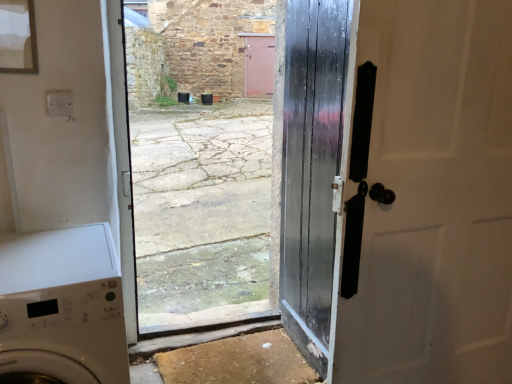
Question: Considering the relative sizes of matte black door at right, the first door when ordered from right to left, and glossy black door at center, placed as the 2th door when sorted from right to left, in the image provided, is matte black door at right, the first door when ordered from right to left, wider than glossy black door at center, placed as the 2th door when sorted from right to left,?

Choices:
 (A) yes
 (B) no

Answer: (A)

Question: From the image's perspective, is matte black door at right, positioned as the second door in left-to-right order, located beneath glossy black door at center, placed as the 2th door when sorted from right to left?

Choices:
 (A) yes
 (B) no

Answer: (A)

Question: Can you confirm if matte black door at right, the first door when ordered from right to left, is shorter than glossy black door at center, placed as the 2th door when sorted from right to left?

Choices:
 (A) no
 (B) yes

Answer: (B)

Question: Is matte black door at right, positioned as the second door in left-to-right order, positioned in front of glossy black door at center, placed as the 2th door when sorted from right to left?

Choices:
 (A) yes
 (B) no

Answer: (A)

Question: Are matte black door at right, the first door when ordered from right to left, and glossy black door at center, placed as the 2th door when sorted from right to left, far apart?

Choices:
 (A) no
 (B) yes

Answer: (A)

Question: Is glossy black door at center, the first door when ordered from left to right, at the back of matte black door at right, positioned as the second door in left-to-right order?

Choices:
 (A) no
 (B) yes

Answer: (B)

Question: From the image's perspective, is matte black door at right, the first door when ordered from right to left, above white glossy washing machine at lower left?

Choices:
 (A) no
 (B) yes

Answer: (B)

Question: Is matte black door at right, positioned as the second door in left-to-right order, taller than white glossy washing machine at lower left?

Choices:
 (A) yes
 (B) no

Answer: (A)

Question: From a real-world perspective, is matte black door at right, positioned as the second door in left-to-right order, located higher than white glossy washing machine at lower left?

Choices:
 (A) yes
 (B) no

Answer: (A)

Question: Can you confirm if matte black door at right, the first door when ordered from right to left, is positioned to the right of white glossy washing machine at lower left?

Choices:
 (A) yes
 (B) no

Answer: (A)

Question: From a real-world perspective, is matte black door at right, positioned as the second door in left-to-right order, below white glossy washing machine at lower left?

Choices:
 (A) no
 (B) yes

Answer: (A)

Question: Can you confirm if matte black door at right, positioned as the second door in left-to-right order, is wider than white glossy washing machine at lower left?

Choices:
 (A) no
 (B) yes

Answer: (A)

Question: From the image's perspective, is glossy black door at center, the first door when ordered from left to right, located beneath matte black door at right, positioned as the second door in left-to-right order?

Choices:
 (A) no
 (B) yes

Answer: (A)